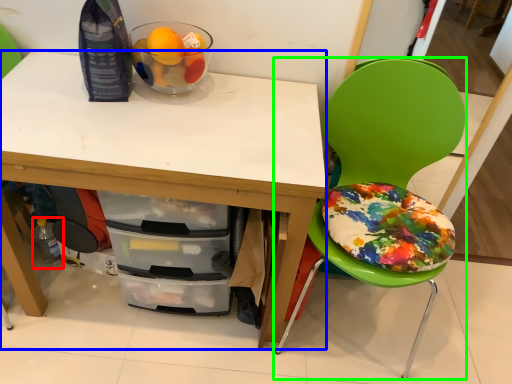
Question: Estimate the real-world distances between objects in this image. Which object is farther from bottle (highlighted by a red box), desk (highlighted by a blue box) or chair (highlighted by a green box)?

Choices:
 (A) desk
 (B) chair

Answer: (B)